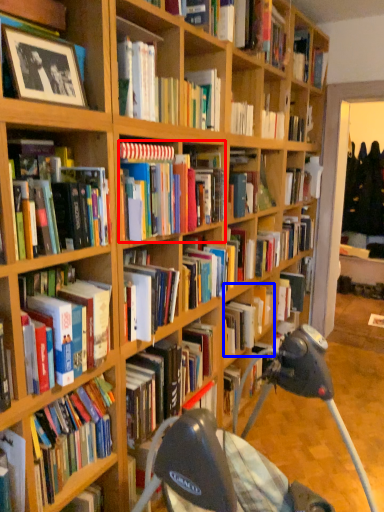
Question: Which object appears farthest to the camera in this image, book (highlighted by a red box) or book (highlighted by a blue box)?

Choices:
 (A) book
 (B) book

Answer: (B)